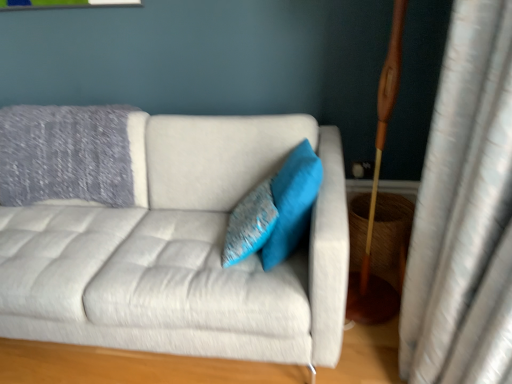
Question: Is turquoise fabric pillow at center, which ranks as the 2th pillow in left-to-right order, wider than light gray fabric couch at center?

Choices:
 (A) yes
 (B) no

Answer: (B)

Question: From the image's perspective, is turquoise fabric pillow at center, which ranks as the 2th pillow in left-to-right order, below light gray fabric couch at center?

Choices:
 (A) no
 (B) yes

Answer: (A)

Question: Is turquoise fabric pillow at center, the first pillow when ordered from right to left, next to light gray fabric couch at center?

Choices:
 (A) yes
 (B) no

Answer: (B)

Question: Does turquoise fabric pillow at center, the first pillow when ordered from right to left, have a lesser height compared to light gray fabric couch at center?

Choices:
 (A) no
 (B) yes

Answer: (B)

Question: Is light gray fabric couch at center a part of turquoise fabric pillow at center, the first pillow when ordered from right to left?

Choices:
 (A) no
 (B) yes

Answer: (A)

Question: Is textured blue pillow at center, the 1th pillow when ordered from left to right, spatially inside light gray fabric couch at center, or outside of it?

Choices:
 (A) outside
 (B) inside

Answer: (B)

Question: Is point (249, 195) positioned closer to the camera than point (42, 231)?

Choices:
 (A) farther
 (B) closer

Answer: (B)

Question: Looking at the image, does textured blue pillow at center, which ranks as the 2th pillow in right-to-left order, seem bigger or smaller compared to light gray fabric couch at center?

Choices:
 (A) small
 (B) big

Answer: (A)

Question: Considering the positions of textured blue pillow at center, the 1th pillow when ordered from left to right, and light gray fabric couch at center in the image, is textured blue pillow at center, the 1th pillow when ordered from left to right, wider or thinner than light gray fabric couch at center?

Choices:
 (A) thin
 (B) wide

Answer: (A)

Question: Based on their sizes in the image, would you say light gray fabric couch at center is bigger or smaller than turquoise fabric pillow at center, which ranks as the 2th pillow in left-to-right order?

Choices:
 (A) big
 (B) small

Answer: (A)

Question: From the image's perspective, relative to turquoise fabric pillow at center, which ranks as the 2th pillow in left-to-right order, is light gray fabric couch at center above or below?

Choices:
 (A) above
 (B) below

Answer: (B)

Question: In terms of width, does light gray fabric couch at center look wider or thinner when compared to turquoise fabric pillow at center, the first pillow when ordered from right to left?

Choices:
 (A) thin
 (B) wide

Answer: (B)

Question: From a real-world perspective, relative to turquoise fabric pillow at center, which ranks as the 2th pillow in left-to-right order, is light gray fabric couch at center vertically above or below?

Choices:
 (A) above
 (B) below

Answer: (B)

Question: Looking at their shapes, would you say light gray fabric couch at center is wider or thinner than textured blue pillow at center, the 1th pillow when ordered from left to right?

Choices:
 (A) thin
 (B) wide

Answer: (B)

Question: Is point (200, 349) positioned closer to the camera than point (239, 248)?

Choices:
 (A) closer
 (B) farther

Answer: (A)